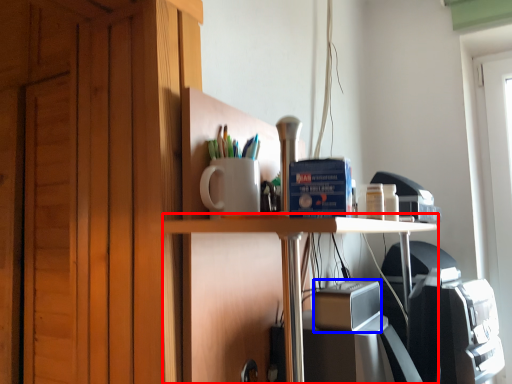
Question: Among these objects, which one is nearest to the camera, table (highlighted by a red box) or appliance (highlighted by a blue box)?

Choices:
 (A) table
 (B) appliance

Answer: (A)